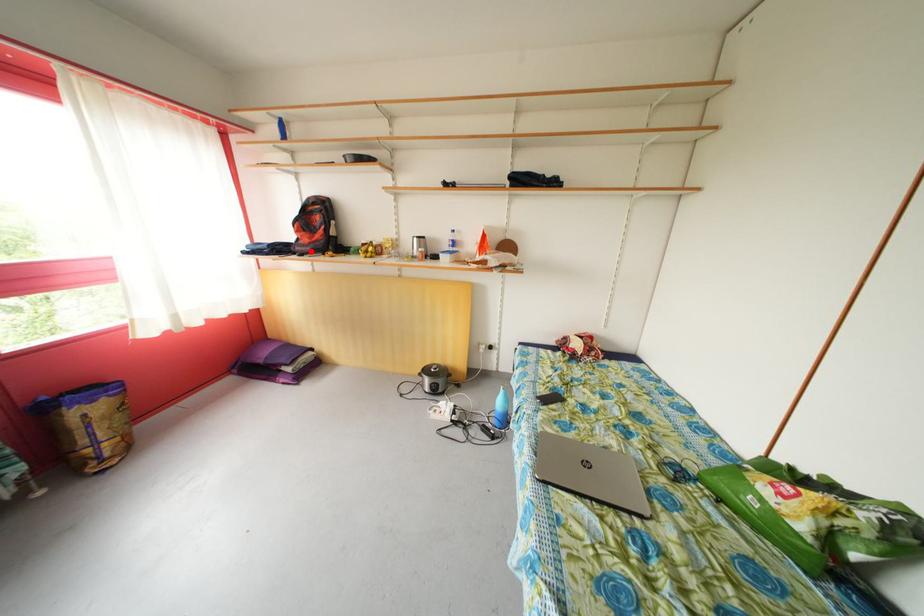
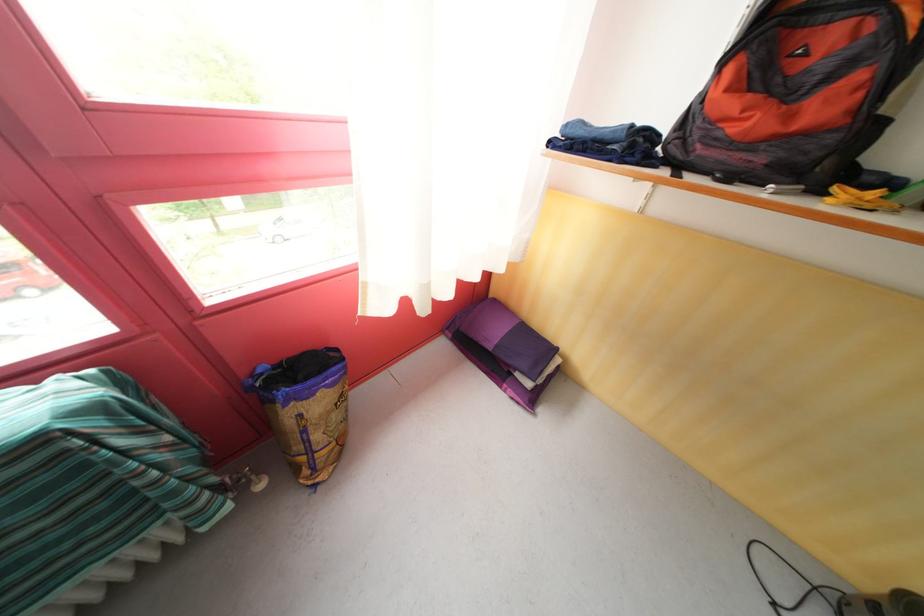
The point at the highlighted location is marked in the first image. Where is the corresponding point in the second image?

(736, 151)